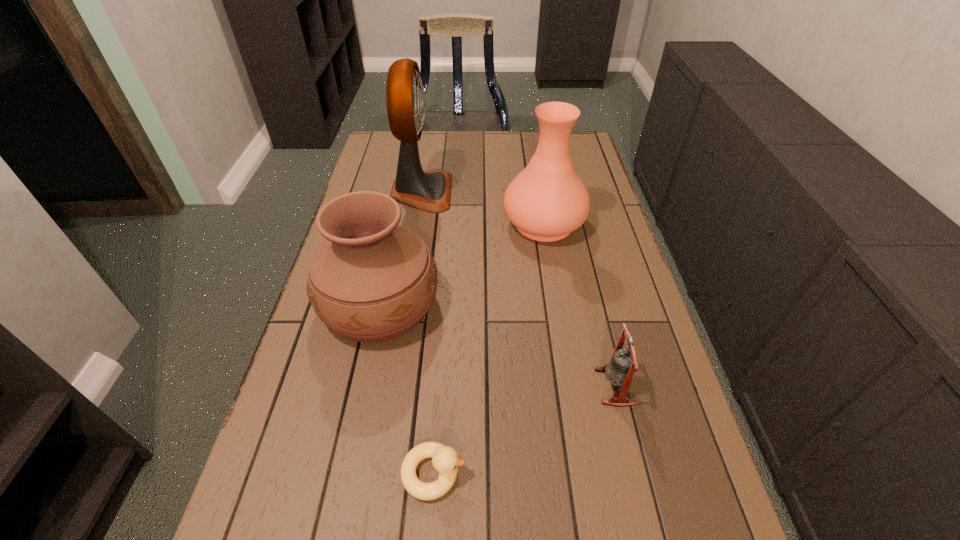
Identify the location of vacant space at the far left corner. The height and width of the screenshot is (540, 960). (388, 148).

Locate an element on the screen. Image resolution: width=960 pixels, height=540 pixels. empty space between the fourth tallest object and the fan is located at coordinates (518, 289).

The height and width of the screenshot is (540, 960). I want to click on empty space that is in between the bell and the nearest object, so click(x=524, y=430).

Where is `vacant space in between the vase and the third farthest object`? The width and height of the screenshot is (960, 540). vacant space in between the vase and the third farthest object is located at coordinates (462, 264).

Find the location of a particular element. Image resolution: width=960 pixels, height=540 pixels. vacant space in between the tallest object and the second nearest object is located at coordinates (518, 289).

The height and width of the screenshot is (540, 960). I want to click on vacant area that lies between the urn and the fourth shortest object, so click(x=462, y=264).

You are a GUI agent. You are given a task and a screenshot of the screen. Output one action in this format:
    pyautogui.click(x=<x>, y=<y>)
    Task: Click on the free point between the duckling and the third tallest object
    Image resolution: width=960 pixels, height=540 pixels.
    Given the screenshot: What is the action you would take?
    pyautogui.click(x=407, y=388)

This screenshot has height=540, width=960. I want to click on vacant area that lies between the tallest object and the shortest object, so click(x=427, y=333).

Locate an element on the screen. The image size is (960, 540). vacant region between the second nearest object and the fan is located at coordinates click(x=518, y=289).

Where is `object that stands as the third closest to the fourth shortest object`? The image size is (960, 540). object that stands as the third closest to the fourth shortest object is located at coordinates (621, 370).